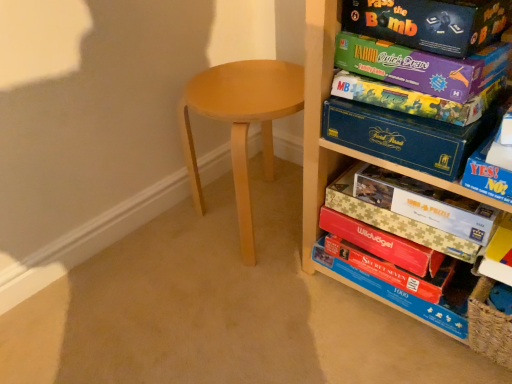
Locate an element on the screen. The width and height of the screenshot is (512, 384). vacant area in front of light brown wood stool at center is located at coordinates (260, 324).